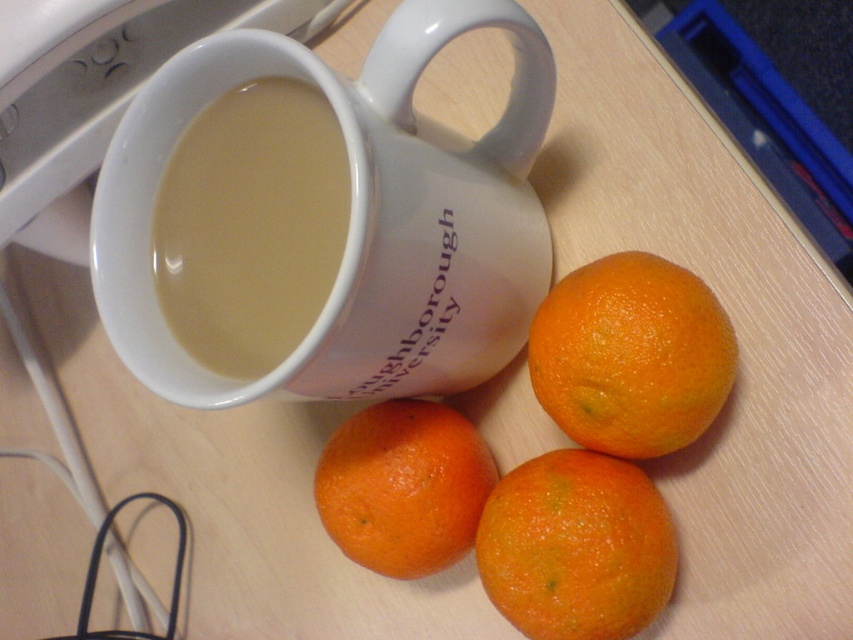
You are organizing items on a desk and need to place the matte ceramic mug at upper center and the orangesmoothorange at lower center. According to the image, which item should be placed to the left side of the other?

The matte ceramic mug at upper center should be placed to the left side of the orangesmoothorange at lower center because the matte ceramic mug at upper center is positioned on the left side of orangesmoothorange at lower center in the image.

You are a delivery robot with a 6 inch wide arm. You need to place a package between the matte ceramic mug at upper center and the orangesmoothorange at lower center. Can your arm fit in the space between them?

The space between the matte ceramic mug at upper center and the orangesmoothorange at lower center is 7.93 inches. Since your arm is 6 inches wide, it can fit in the space between them.

From the picture: You are a photographer adjusting your camera settings to focus on two points in the scene. The first point is at coordinate point(480, 205) and the second is at coordinate point(238, 368). Which point should you focus on first to ensure the closest object is in sharp focus?

Point(480, 205) is further to the camera than point(238, 368), so you should focus on point(480, 205) first to capture the closer object in sharp focus.